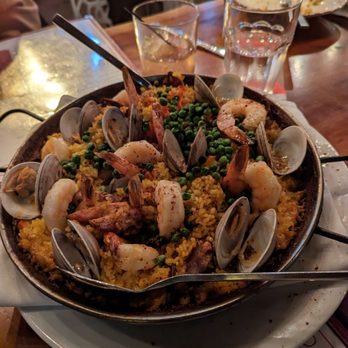
You are a GUI agent. You are given a task and a screenshot of the screen. Output one action in this format:
    pyautogui.click(x=<x>, y=<y>)
    Task: Click on the bowl
    The image size is (348, 348).
    Given the screenshot: What is the action you would take?
    [72, 301]